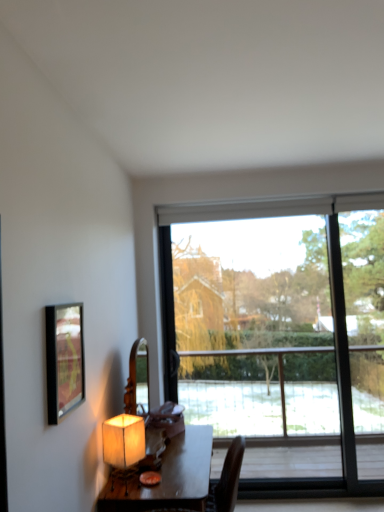
Question: Is wooden table at center oriented towards transparent glass window at center?

Choices:
 (A) yes
 (B) no

Answer: (B)

Question: From a real-world perspective, does wooden table at center stand above transparent glass window at center?

Choices:
 (A) yes
 (B) no

Answer: (B)

Question: Is the depth of wooden table at center greater than that of transparent glass window at center?

Choices:
 (A) yes
 (B) no

Answer: (B)

Question: Is wooden table at center touching transparent glass window at center?

Choices:
 (A) yes
 (B) no

Answer: (B)

Question: From the image's perspective, is wooden table at center on top of transparent glass window at center?

Choices:
 (A) no
 (B) yes

Answer: (A)

Question: From their relative heights in the image, would you say transparent glass window at center is taller or shorter than metallic gold picture frame at upper left?

Choices:
 (A) tall
 (B) short

Answer: (A)

Question: From a real-world perspective, is transparent glass window at center physically located above or below metallic gold picture frame at upper left?

Choices:
 (A) below
 (B) above

Answer: (A)

Question: Is transparent glass window at center to the left or to the right of metallic gold picture frame at upper left in the image?

Choices:
 (A) right
 (B) left

Answer: (A)

Question: Is transparent glass window at center bigger or smaller than metallic gold picture frame at upper left?

Choices:
 (A) big
 (B) small

Answer: (A)

Question: Based on their positions, is metallic gold picture frame at upper left located to the left or right of transparent glass window at center?

Choices:
 (A) right
 (B) left

Answer: (B)

Question: Is point (56, 336) positioned closer to the camera than point (362, 334)?

Choices:
 (A) closer
 (B) farther

Answer: (A)

Question: In terms of width, does metallic gold picture frame at upper left look wider or thinner when compared to transparent glass window at center?

Choices:
 (A) thin
 (B) wide

Answer: (A)

Question: From the image's perspective, relative to transparent glass window at center, is metallic gold picture frame at upper left above or below?

Choices:
 (A) below
 (B) above

Answer: (B)

Question: From a real-world perspective, is matte beige lampshade at lower left positioned above or below transparent glass window at center?

Choices:
 (A) above
 (B) below

Answer: (B)

Question: In terms of height, does matte beige lampshade at lower left look taller or shorter compared to transparent glass window at center?

Choices:
 (A) tall
 (B) short

Answer: (B)